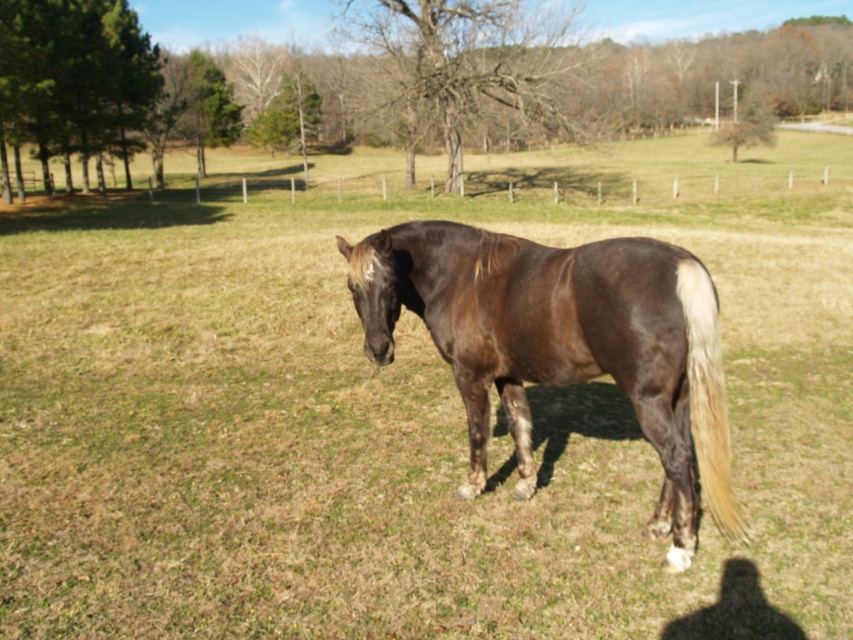
You are a photographer trying to capture a closeup of the brown glossy horse at center and the white silky tail at right. Your camera has a minimum focus distance of 20 inches. Can you focus on both subjects simultaneously without moving your position?

The brown glossy horse at center and white silky tail at right are 20.69 inches apart from each other. Since the distance between them is greater than the camera minimum focus distance of 20 inches, you can focus on both subjects simultaneously without moving your position.

You are a farmer checking the space needed to move your brown glossy horse at center and white silky tail at right through a narrow gate. The gate is exactly as wide as the horse. Can the horse pass through the gate while also keeping its tail safely within the space?

The brown glossy horse at center might be wider than white silky tail at right. Since the gate is exactly as wide as the horse, the horse itself should fit, but the tail might extend beyond the gate if it isn